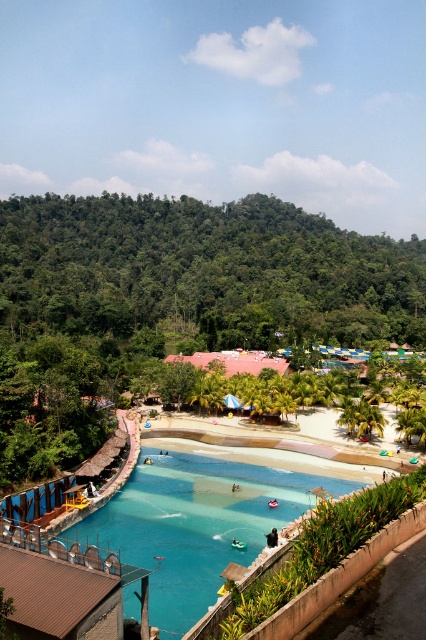
Looking at this image, between green leafy trees at upper left and blue glossy water at center, which one is positioned lower?

Positioned lower is blue glossy water at center.

Can you confirm if green leafy trees at upper left is positioned above blue glossy water at center?

Yes, green leafy trees at upper left is above blue glossy water at center.

Measure the distance between point (241, 285) and camera.

Point (241, 285) and camera are 260.37 meters apart.

This screenshot has height=640, width=426. Identify the location of green leafy trees at upper left. (204, 272).